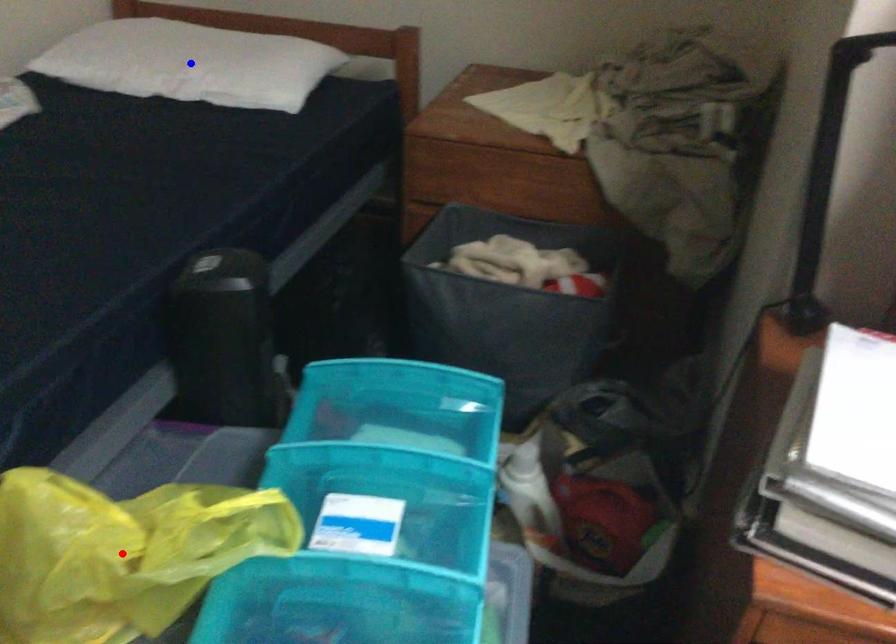
Question: Which of the two points in the image is closer to the camera?

Choices:
 (A) Blue point is closer.
 (B) Red point is closer.

Answer: (B)